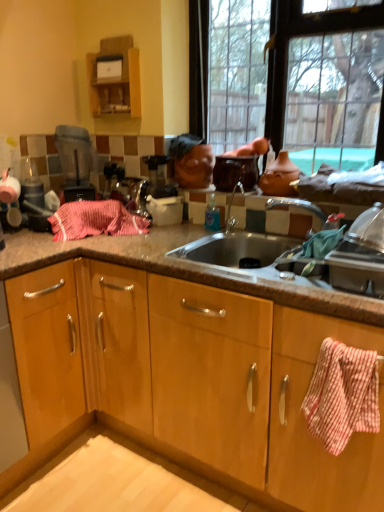
This screenshot has width=384, height=512. In order to click on free space above red checkered towel at right, acting as the 1th cabinetry starting from the bottom (from a real-world perspective) in this screenshot , I will do `click(342, 343)`.